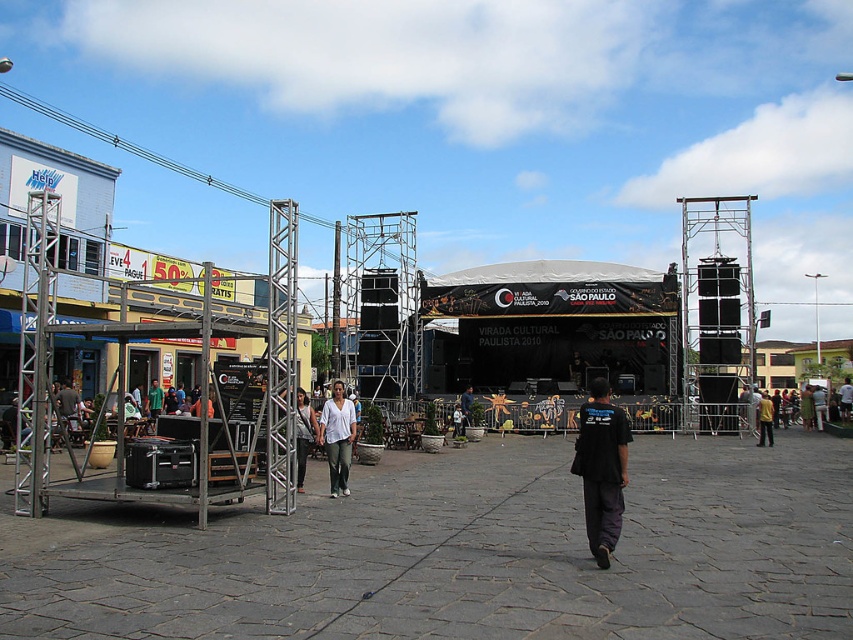
Measure the distance from black matte shirt at center to matte white shirt at center.

The distance of black matte shirt at center from matte white shirt at center is 17.11 meters.

The width and height of the screenshot is (853, 640). In order to click on black matte shirt at center in this screenshot , I will do `click(601, 468)`.

Is point (592, 396) positioned before point (468, 424)?

Yes, point (592, 396) is in front of point (468, 424).

The height and width of the screenshot is (640, 853). I want to click on black matte shirt at center, so click(x=601, y=468).

Is denim jacket at center smaller than matte white shirt at center?

No, denim jacket at center is not smaller than matte white shirt at center.

From the picture: Does denim jacket at center have a lesser width compared to matte white shirt at center?

Yes, denim jacket at center is thinner than matte white shirt at center.

Does point (300, 444) come farther from viewer compared to point (473, 401)?

That is False.

You are a GUI agent. You are given a task and a screenshot of the screen. Output one action in this format:
    pyautogui.click(x=<x>, y=<y>)
    Task: Click on the denim jacket at center
    The image size is (853, 640).
    Given the screenshot: What is the action you would take?
    pyautogui.click(x=303, y=435)

Who is higher up, black matte shirt at center or denim jacket at center?

Positioned higher is black matte shirt at center.

Does black matte shirt at center appear on the left side of denim jacket at center?

In fact, black matte shirt at center is to the right of denim jacket at center.

You are a GUI agent. You are given a task and a screenshot of the screen. Output one action in this format:
    pyautogui.click(x=<x>, y=<y>)
    Task: Click on the black matte shirt at center
    The image size is (853, 640).
    Given the screenshot: What is the action you would take?
    pyautogui.click(x=601, y=468)